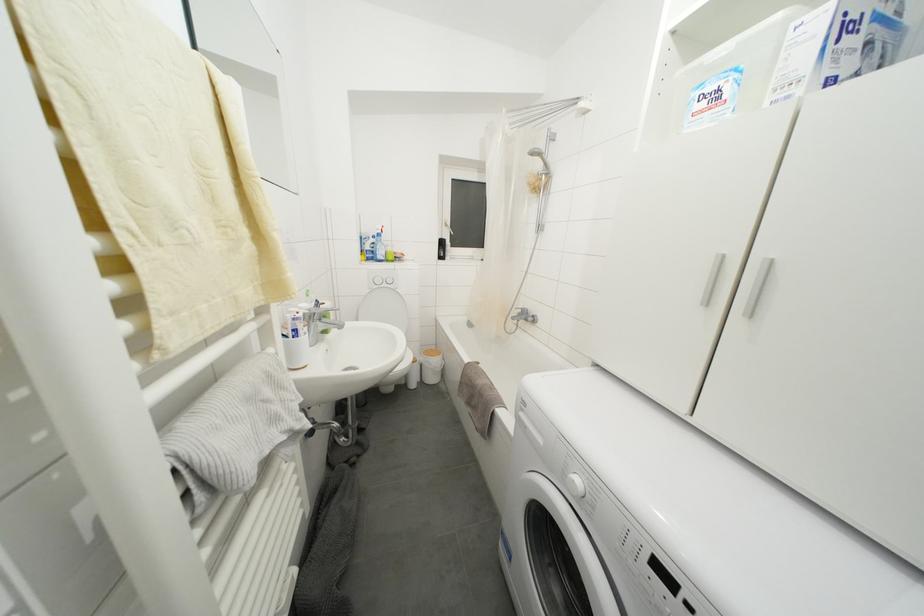
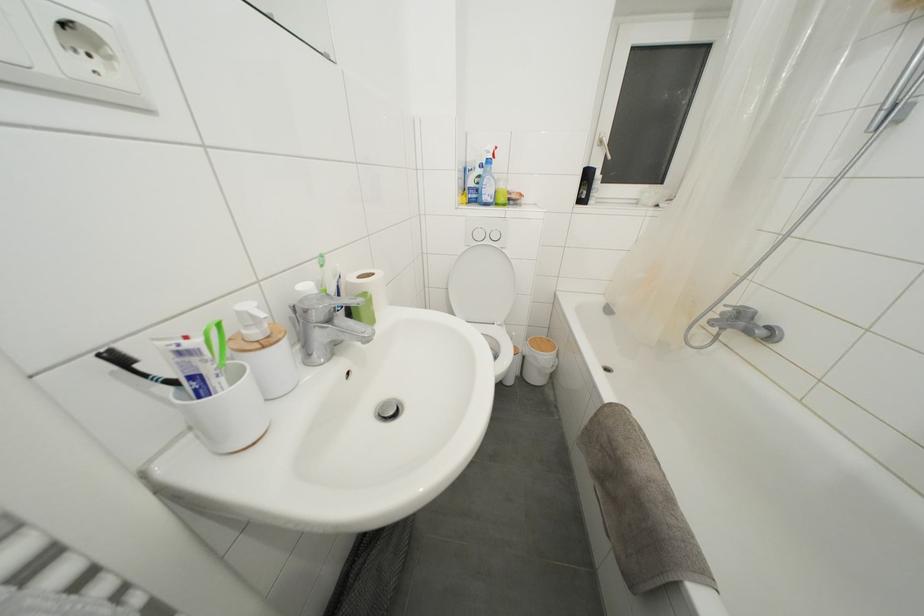
In the second image, find the point that corresponds to point (451, 229) in the first image.

(604, 148)